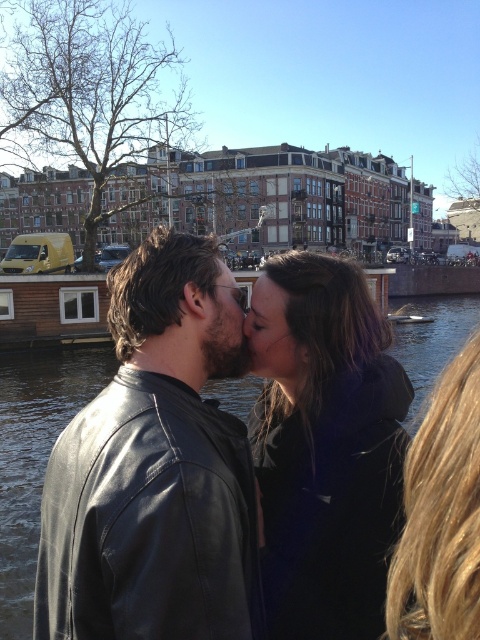
Is black leather jacket at center positioned before clear water at center?

Yes, it is.

Who is positioned more to the left, black leather jacket at center or clear water at center?

From the viewer's perspective, black leather jacket at center appears more on the left side.

Is point (168, 349) behind point (4, 396)?

No, (168, 349) is closer to viewer.

Find the location of a particular element. The image size is (480, 640). black leather jacket at center is located at coordinates (156, 468).

Which of these two, black leather jacket at center or matte black forehead at center, stands shorter?

matte black forehead at center is shorter.

Is black leather jacket at center to the left of matte black forehead at center from the viewer's perspective?

Correct, you'll find black leather jacket at center to the left of matte black forehead at center.

Where is `black leather jacket at center`? This screenshot has width=480, height=640. black leather jacket at center is located at coordinates (156, 468).

You are a GUI agent. You are given a task and a screenshot of the screen. Output one action in this format:
    pyautogui.click(x=<x>, y=<y>)
    Task: Click on the black leather jacket at center
    Image resolution: width=480 pixels, height=640 pixels.
    Given the screenshot: What is the action you would take?
    [156, 468]

Is black leather jacket at center shorter than dark brown leather jacket at center?

In fact, black leather jacket at center may be taller than dark brown leather jacket at center.

In the scene shown: Which of these two, black leather jacket at center or dark brown leather jacket at center, stands shorter?

dark brown leather jacket at center

Which is in front, point (211, 515) or point (356, 604)?

Point (211, 515) is in front.

Where is `black leather jacket at center`? The image size is (480, 640). black leather jacket at center is located at coordinates 156,468.